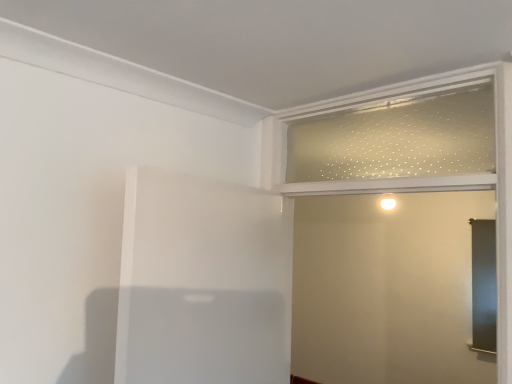
Find the location of a particular element. The height and width of the screenshot is (384, 512). clear glass window frame at upper right is located at coordinates (398, 137).

Is clear frosted glass screen door at upper right in contact with clear glass window frame at upper right?

No, clear frosted glass screen door at upper right is not in contact with clear glass window frame at upper right.

Considering the relative sizes of clear frosted glass screen door at upper right and clear glass window frame at upper right in the image provided, is clear frosted glass screen door at upper right wider than clear glass window frame at upper right?

Correct, the width of clear frosted glass screen door at upper right exceeds that of clear glass window frame at upper right.

Is the depth of clear frosted glass screen door at upper right greater than that of clear glass window frame at upper right?

No, the depth of clear frosted glass screen door at upper right is less than that of clear glass window frame at upper right.

From a real-world perspective, which is physically above, clear frosted glass screen door at upper right or clear glass window frame at upper right?

In real-world perspective, clear glass window frame at upper right is above.

In terms of size, does white matte elevator at center appear bigger or smaller than clear frosted glass screen door at upper right?

Considering their sizes, white matte elevator at center takes up less space than clear frosted glass screen door at upper right.

Which object is further away from the camera taking this photo, white matte elevator at center or clear frosted glass screen door at upper right?

clear frosted glass screen door at upper right is more distant.

From the image's perspective, which one is positioned lower, white matte elevator at center or clear frosted glass screen door at upper right?

From the image's view, white matte elevator at center is below.

From a real-world perspective, is clear glass window frame at upper right on clear frosted glass screen door at upper right?

Yes, from a real-world perspective, clear glass window frame at upper right is over clear frosted glass screen door at upper right

From their relative heights in the image, would you say clear glass window frame at upper right is taller or shorter than clear frosted glass screen door at upper right?

Considering their sizes, clear glass window frame at upper right has less height than clear frosted glass screen door at upper right.

Is point (377, 132) positioned before point (365, 379)?

Yes, it is in front of point (365, 379).

At what (x,y) coordinates should I click in order to perform the action: click on window frame on the right side of clear frosted glass screen door at upper right. Please return your answer as a coordinate pair (x, y). Looking at the image, I should click on (398, 137).

Is clear glass window frame at upper right facing towards white matte elevator at center?

No.

Can you tell me how much clear glass window frame at upper right and white matte elevator at center differ in facing direction?

102 degrees.

Choose the correct answer: Is clear glass window frame at upper right inside white matte elevator at center or outside it?

clear glass window frame at upper right lies outside white matte elevator at center.

Is clear glass window frame at upper right in contact with white matte elevator at center?

There is a gap between clear glass window frame at upper right and white matte elevator at center.

Which is correct: white matte elevator at center is inside clear glass window frame at upper right, or outside of it?

white matte elevator at center cannot be found inside clear glass window frame at upper right.

Which of these two, white matte elevator at center or clear glass window frame at upper right, is thinner?

clear glass window frame at upper right.

Is white matte elevator at center positioned with its back to clear glass window frame at upper right?

No, clear glass window frame at upper right is not at the back of white matte elevator at center.

Can you tell me how much white matte elevator at center and clear glass window frame at upper right differ in facing direction?

The angular difference between white matte elevator at center and clear glass window frame at upper right is 102 degrees.

Considering the sizes of objects clear frosted glass screen door at upper right and white matte elevator at center in the image provided, who is thinner, clear frosted glass screen door at upper right or white matte elevator at center?

With smaller width is white matte elevator at center.

Would you say clear frosted glass screen door at upper right contains white matte elevator at center?

Definitely not — white matte elevator at center is not inside clear frosted glass screen door at upper right.

From a real-world perspective, is clear frosted glass screen door at upper right on white matte elevator at center?

Yes.

You are a GUI agent. You are given a task and a screenshot of the screen. Output one action in this format:
    pyautogui.click(x=<x>, y=<y>)
    Task: Click on the window frame behind the clear frosted glass screen door at upper right
    The height and width of the screenshot is (384, 512).
    Given the screenshot: What is the action you would take?
    pyautogui.click(x=398, y=137)

Where is `elevator lying below the clear frosted glass screen door at upper right (from the image's perspective)`? elevator lying below the clear frosted glass screen door at upper right (from the image's perspective) is located at coordinates (202, 282).

From the image, which object appears to be farther from clear glass window frame at upper right, white matte elevator at center or clear frosted glass screen door at upper right?

clear frosted glass screen door at upper right.

Looking at the image, which one is located closer to clear frosted glass screen door at upper right, white matte elevator at center or clear glass window frame at upper right?

clear glass window frame at upper right is positioned closer to the anchor clear frosted glass screen door at upper right.

Which object lies nearer to the anchor point clear frosted glass screen door at upper right, clear glass window frame at upper right or white matte elevator at center?

clear glass window frame at upper right is positioned closer to the anchor clear frosted glass screen door at upper right.

Which object lies further to the anchor point clear glass window frame at upper right, clear frosted glass screen door at upper right or white matte elevator at center?

Based on the image, clear frosted glass screen door at upper right appears to be further to clear glass window frame at upper right.

Considering their positions, is clear frosted glass screen door at upper right positioned further to white matte elevator at center than clear glass window frame at upper right?

clear frosted glass screen door at upper right is positioned further to the anchor white matte elevator at center.

Estimate the real-world distances between objects in this image. Which object is closer to white matte elevator at center, clear glass window frame at upper right or clear frosted glass screen door at upper right?

clear glass window frame at upper right.

Identify the location of screen door situated between white matte elevator at center and clear glass window frame at upper right from left to right. This screenshot has width=512, height=384. (386, 289).